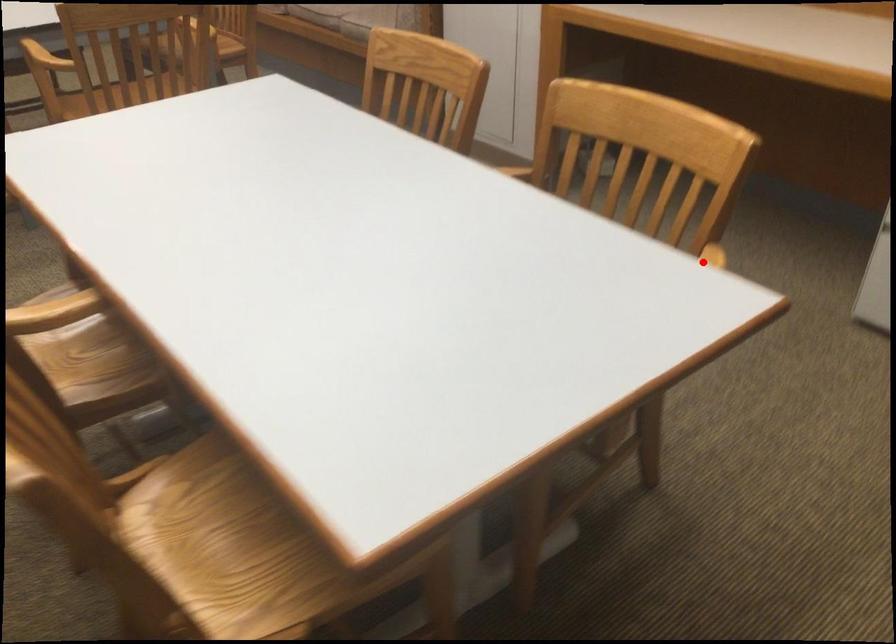
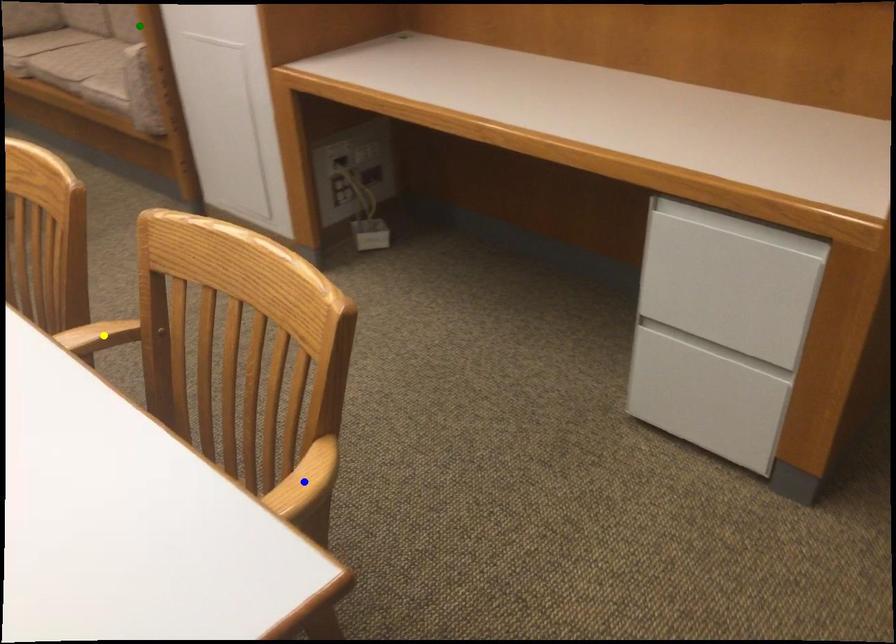
Question: I am providing you with two images of the same scene from different viewpoints. A red point is marked on the first image. You are given multiple points on the second image. Which point in image 2 represents the same 3d spot as the red point in image 1?

Choices:
 (A) blue point
 (B) yellow point
 (C) green point

Answer: (A)